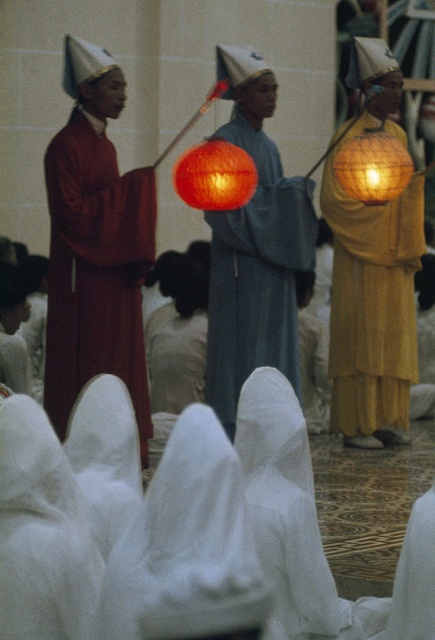
You are a photographer trying to capture a photo of the yellow matte robe at right and the bright orange paper lantern at center. Based on their positions, which object should you focus on first to ensure both are in frame without moving the camera?

Since the yellow matte robe at right might be wider than the bright orange paper lantern at center, you should focus on the yellow matte robe at right first to accommodate its width in the frame.

You are standing at the camera position and want to hand a ceremonial item to the person wearing the yellow matte robe at right. Considering the distance, can you reach them without moving closer?

The yellow matte robe at right is 15.94 meters away from the camera, so you cannot reach them without moving closer.